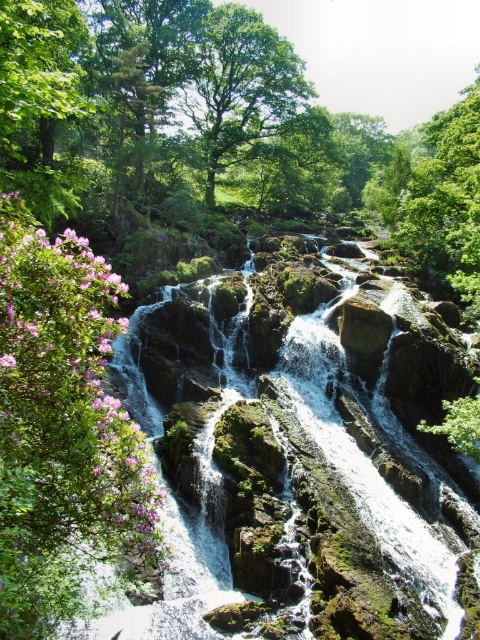
Between point (12, 516) and point (201, 124), which one is positioned in front?

Positioned in front is point (12, 516).

What do you see at coordinates (64, 403) in the screenshot? This screenshot has height=640, width=480. I see `pink matte flower at left` at bounding box center [64, 403].

Does point (80, 529) lie behind point (268, 36)?

No, it is not.

Image resolution: width=480 pixels, height=640 pixels. Find the location of `pink matte flower at left`. pink matte flower at left is located at coordinates (64, 403).

Who is taller, green mossy rocks at center or green leafy tree at upper center?

green leafy tree at upper center

Locate an element on the screen. The width and height of the screenshot is (480, 640). green mossy rocks at center is located at coordinates (288, 476).

Can you confirm if green mossy rocks at center is positioned above pink matte flower at left?

Actually, green mossy rocks at center is below pink matte flower at left.

Which of these two, green mossy rocks at center or pink matte flower at left, stands taller?

green mossy rocks at center is taller.

Identify the location of green mossy rocks at center. This screenshot has height=640, width=480. (288, 476).

At what (x,y) coordinates should I click in order to perform the action: click on green mossy rocks at center. Please return your answer as a coordinate pair (x, y). This screenshot has width=480, height=640. Looking at the image, I should click on (288, 476).